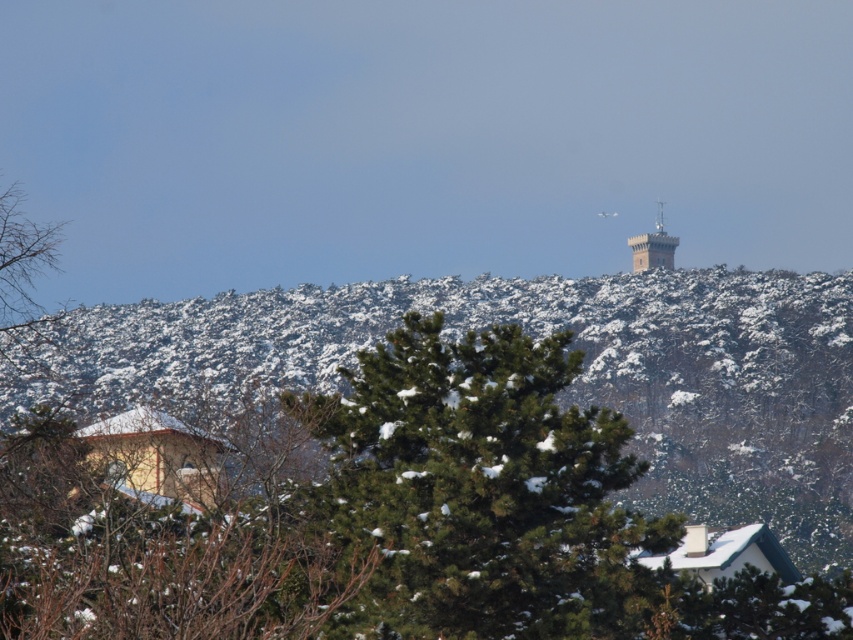
Question: Does green textured pine tree at center have a lesser width compared to brick tower at upper center?

Choices:
 (A) yes
 (B) no

Answer: (B)

Question: Is green textured pine tree at center to the left of brick tower at upper center from the viewer's perspective?

Choices:
 (A) no
 (B) yes

Answer: (B)

Question: Can you confirm if green textured pine tree at center is positioned to the right of brick tower at upper center?

Choices:
 (A) yes
 (B) no

Answer: (B)

Question: Which point is farther to the camera?

Choices:
 (A) (537, 388)
 (B) (660, 228)

Answer: (B)

Question: Among these points, which one is nearest to the camera?

Choices:
 (A) (662, 221)
 (B) (387, 595)

Answer: (B)